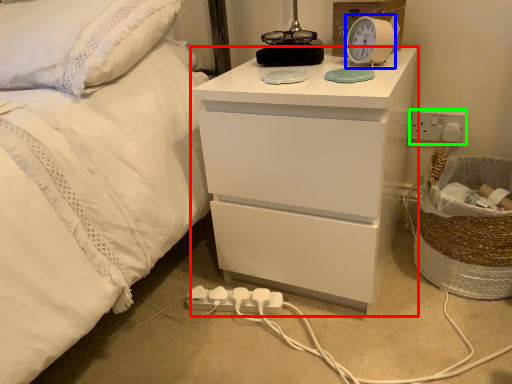
Question: Based on their relative distances, which object is nearer to chest of drawers (highlighted by a red box)? Choose from alarm clock (highlighted by a blue box) and electric outlet (highlighted by a green box).

Choices:
 (A) alarm clock
 (B) electric outlet

Answer: (A)